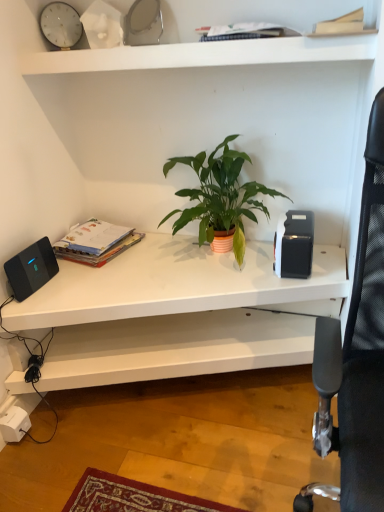
The width and height of the screenshot is (384, 512). I want to click on blank space situated above matte paperbacks at left, arranged as the second paperback book when viewed from the front (from a real-world perspective), so click(x=79, y=230).